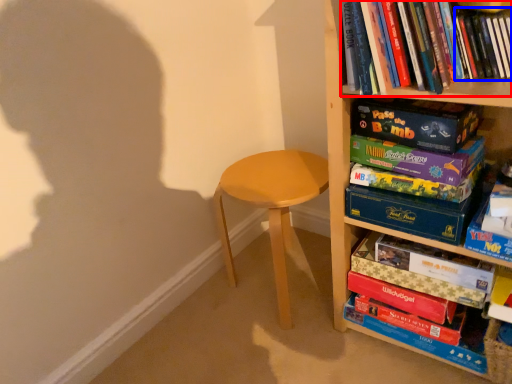
Question: Which point is further to the camera, book (highlighted by a red box) or book (highlighted by a blue box)?

Choices:
 (A) book
 (B) book

Answer: (B)